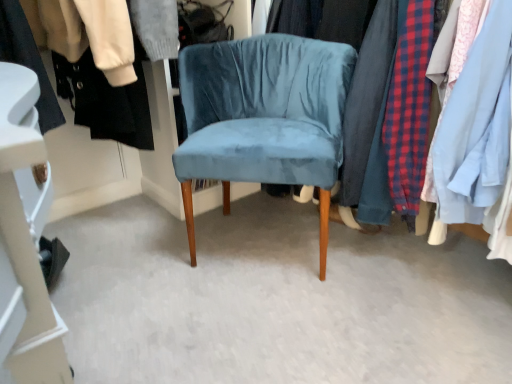
Identify the location of free area below velvet blue chair at center (from a real-world perspective). (262, 243).